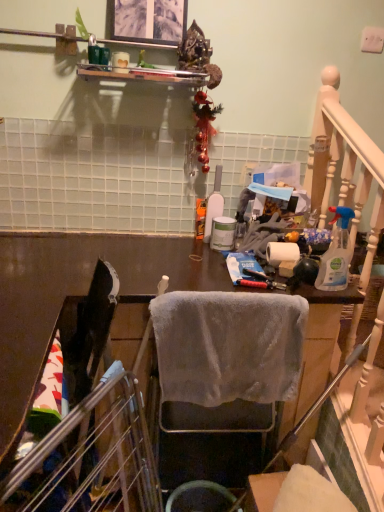
Question: Can we say metallic gold ornament at upper center lies outside clear plastic spray bottle at right, which ranks as the first bottle in right-to-left order?

Choices:
 (A) yes
 (B) no

Answer: (A)

Question: From a real-world perspective, is metallic gold ornament at upper center over clear plastic spray bottle at right, the 2th bottle from the left?

Choices:
 (A) no
 (B) yes

Answer: (B)

Question: Does metallic gold ornament at upper center come in front of clear plastic spray bottle at right, marked as the second bottle in a back-to-front arrangement?

Choices:
 (A) yes
 (B) no

Answer: (B)

Question: Is metallic gold ornament at upper center positioned with its back to clear plastic spray bottle at right, marked as the second bottle in a back-to-front arrangement?

Choices:
 (A) no
 (B) yes

Answer: (A)

Question: From the image's perspective, is metallic gold ornament at upper center on top of clear plastic spray bottle at right, the 2th bottle from the left?

Choices:
 (A) yes
 (B) no

Answer: (A)

Question: Can you confirm if metallic gold ornament at upper center is taller than clear plastic spray bottle at right, marked as the second bottle in a back-to-front arrangement?

Choices:
 (A) yes
 (B) no

Answer: (A)

Question: Considering the relative sizes of white matte toilet paper at center and gray fabric chair at center in the image provided, is white matte toilet paper at center thinner than gray fabric chair at center?

Choices:
 (A) yes
 (B) no

Answer: (A)

Question: Is white matte toilet paper at center at the right side of gray fabric chair at center?

Choices:
 (A) yes
 (B) no

Answer: (A)

Question: Can you confirm if white matte toilet paper at center is taller than gray fabric chair at center?

Choices:
 (A) no
 (B) yes

Answer: (A)

Question: Is white matte toilet paper at center far away from gray fabric chair at center?

Choices:
 (A) no
 (B) yes

Answer: (A)

Question: Considering the relative sizes of white matte toilet paper at center and gray fabric chair at center in the image provided, is white matte toilet paper at center wider than gray fabric chair at center?

Choices:
 (A) yes
 (B) no

Answer: (B)

Question: From the image's perspective, is white matte toilet paper at center located above gray fabric chair at center?

Choices:
 (A) no
 (B) yes

Answer: (B)

Question: From a real-world perspective, is clear plastic spray bottle at right, marked as the second bottle in a back-to-front arrangement, physically below metallic silver picture frame at upper center?

Choices:
 (A) yes
 (B) no

Answer: (A)